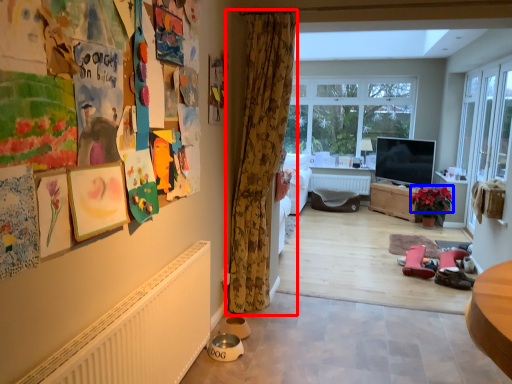
Question: Which object is further to the camera taking this photo, curtain (highlighted by a red box) or flower (highlighted by a blue box)?

Choices:
 (A) curtain
 (B) flower

Answer: (B)